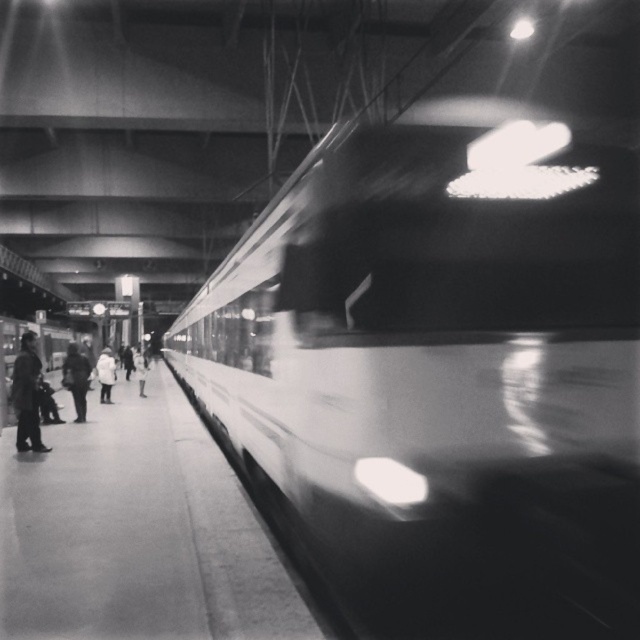
Question: Which of the following is the closest to the observer?

Choices:
 (A) click(x=109, y=385)
 (B) click(x=275, y=433)
 (C) click(x=29, y=333)

Answer: (B)

Question: Which object is farther from the camera taking this photo?

Choices:
 (A) white matte coat at lower left
 (B) dark wool coat at left

Answer: (A)

Question: Can you confirm if smooth white train at right is thinner than white matte coat at lower left?

Choices:
 (A) yes
 (B) no

Answer: (B)

Question: Which point is closer to the camera?

Choices:
 (A) (x=106, y=403)
 (B) (x=77, y=401)
 (C) (x=401, y=262)
 (D) (x=29, y=330)

Answer: (C)

Question: Where is white matte coat at lower left located in relation to white fabric coat at left in the image?

Choices:
 (A) below
 (B) above

Answer: (B)

Question: Does dark fabric coat at left have a larger size compared to white matte coat at lower left?

Choices:
 (A) yes
 (B) no

Answer: (A)